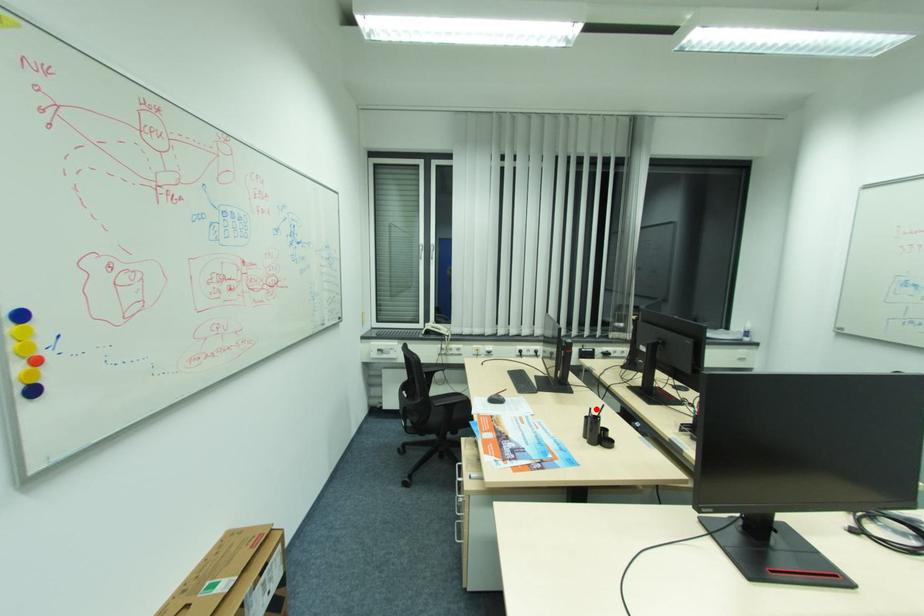
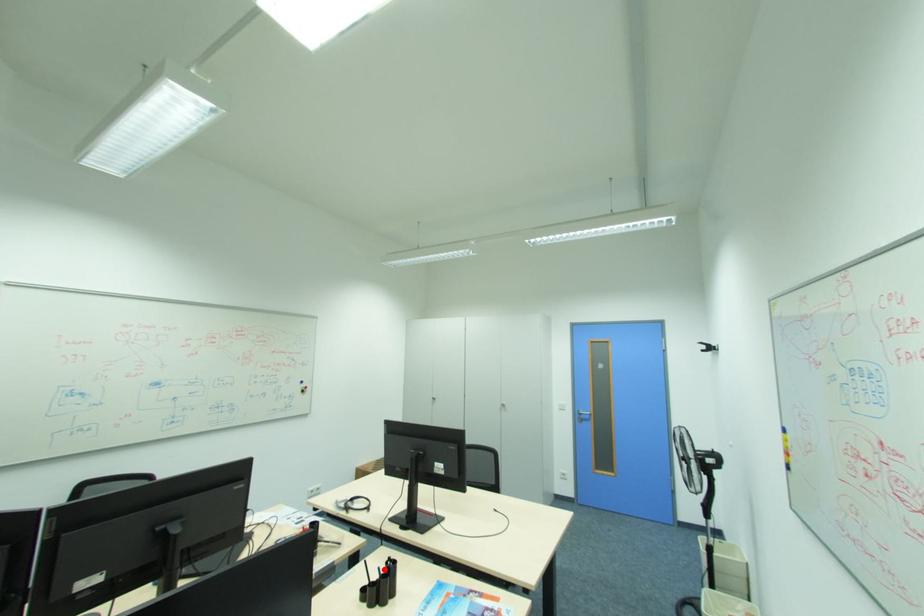
I am providing you with two images of the same scene from different viewpoints. A red point is marked on the first image and another point is marked on the second image. Do the highlighted points in image1 and image2 indicate the same real-world spot?

Yes